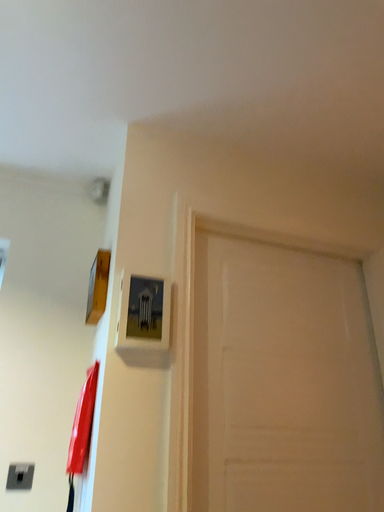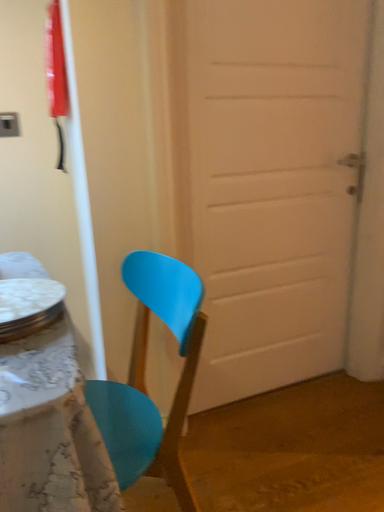
Question: Which way did the camera rotate in the video?

Choices:
 (A) rotated downward
 (B) rotated upward

Answer: (A)